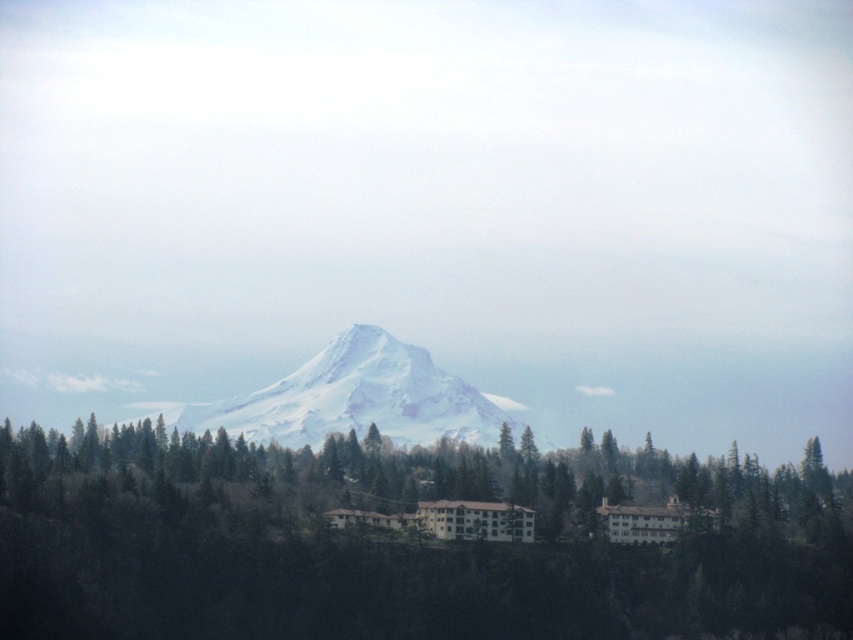
What do you see at coordinates (392, 547) in the screenshot? Image resolution: width=853 pixels, height=640 pixels. I see `green matte trees at center` at bounding box center [392, 547].

Is point (45, 460) positioned behind point (444, 400)?

No, (45, 460) is in front of (444, 400).

You are a GUI agent. You are given a task and a screenshot of the screen. Output one action in this format:
    pyautogui.click(x=<x>, y=<y>)
    Task: Click on the green matte trees at center
    The height and width of the screenshot is (640, 853).
    Given the screenshot: What is the action you would take?
    pyautogui.click(x=392, y=547)